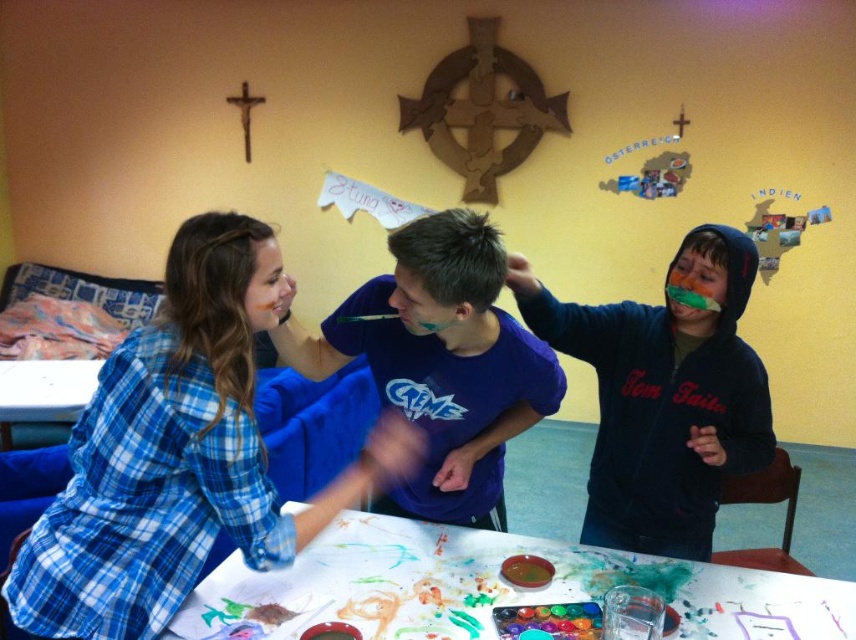
Question: Is blue plaid shirt at upper left bigger than dark blue hoodie at center?

Choices:
 (A) yes
 (B) no

Answer: (A)

Question: Among these points, which one is farthest from the camera?

Choices:
 (A) (717, 348)
 (B) (189, 253)

Answer: (A)

Question: Does blue plaid shirt at upper left appear under dark blue hoodie at center?

Choices:
 (A) yes
 (B) no

Answer: (A)

Question: Which of the following is the farthest from the observer?

Choices:
 (A) (432, 604)
 (B) (694, 518)
 (C) (105, 360)

Answer: (B)

Question: Can you confirm if blue plaid shirt at upper left is smaller than dark blue hoodie at center?

Choices:
 (A) no
 (B) yes

Answer: (A)

Question: Among these points, which one is nearest to the camera?

Choices:
 (A) (724, 588)
 (B) (597, 352)
 (C) (377, 438)

Answer: (A)